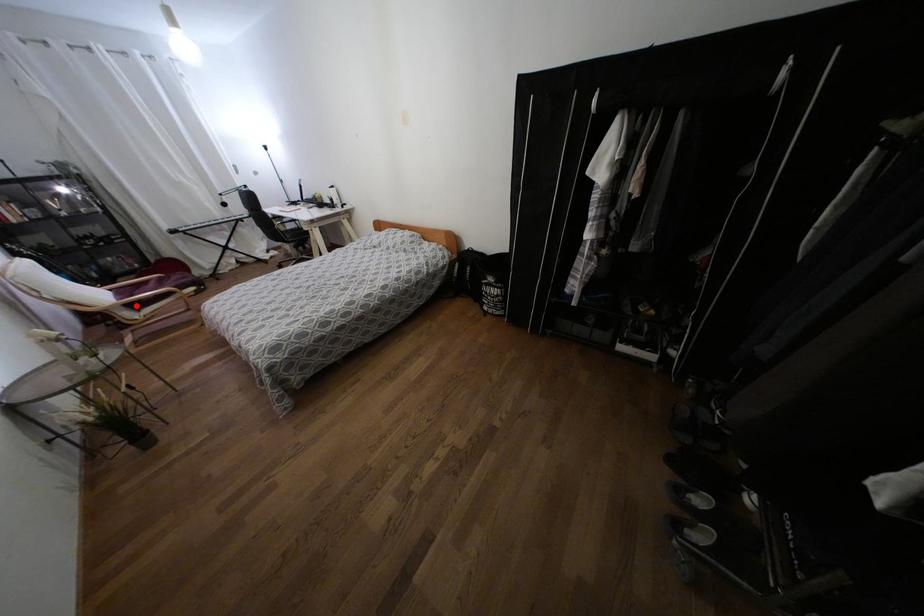
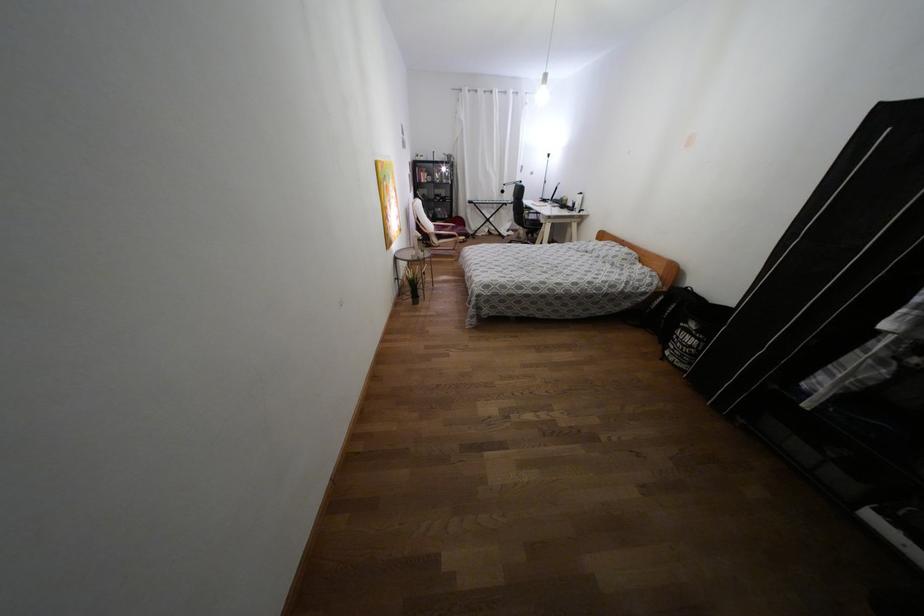
Where in the second image is the point corresponding to the highlighted location from the first image?

(439, 237)